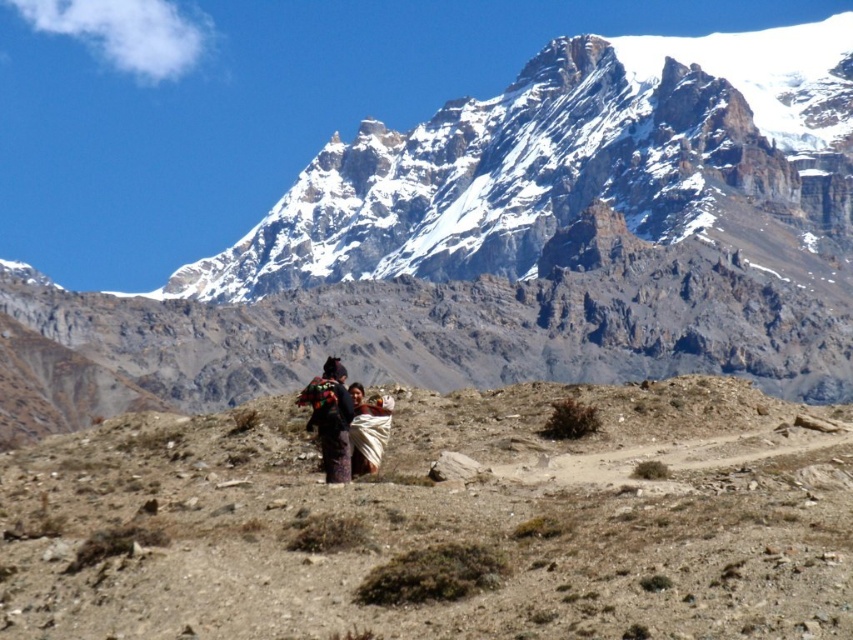
You are a hiker planning to follow the path in the mountain scene. You see two points marked on the path. The first point is at coordinate point (833, 280), and the second is at point (224, 433). Which point should you reach first if you are hiking from the bottom of the mountain to the top?

Point (224, 433) should be reached first because it is in front of point (833, 280) when hiking from the bottom to the top of the mountain.

Consider the image. What is the 2D coordinate of the snowy granite mountain range at upper center in the image?

The 2D coordinate of the snowy granite mountain range at upper center is at point [509,243].

You are planning to set up a tent for a mountain hike and have two options. The first option is to place it on the brown textured hillside at center, and the second is to place it on the multicolored woven shawl at center. Which location would provide a more stable base for the tent?

The brown textured hillside at center is much taller than the multicolored woven shawl at center, so it would provide a more stable base for the tent.